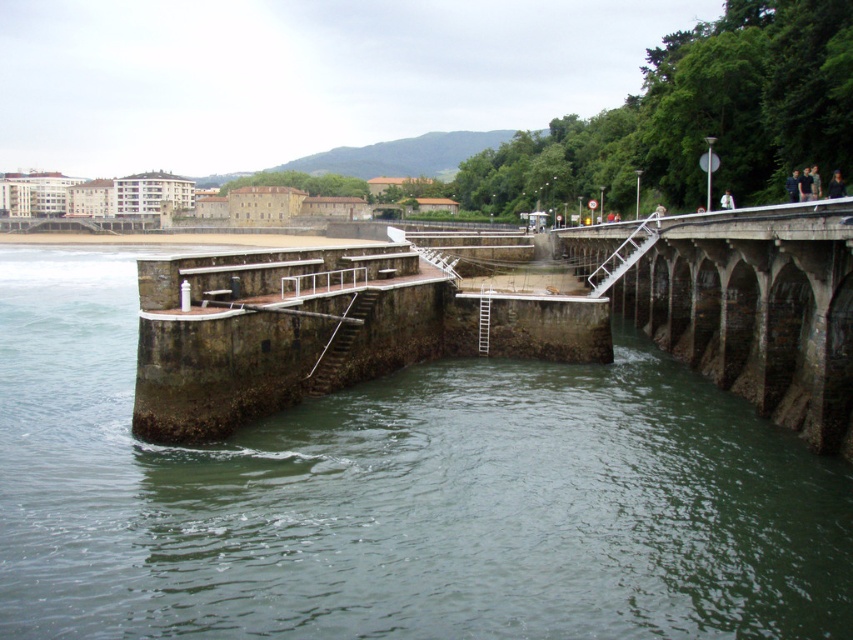
Question: Can you confirm if green stone river at center is positioned below stone bridge at center?

Choices:
 (A) yes
 (B) no

Answer: (A)

Question: Is green stone river at center below stone bridge at center?

Choices:
 (A) no
 (B) yes

Answer: (B)

Question: Considering the real-world distances, which object is closest to the dark blue fabric jacket at upper right?

Choices:
 (A) rusty metal stairs at center
 (B) green stone river at center
 (C) stone bridge at center
 (D) white metal stairs at center

Answer: (D)

Question: Based on their relative distances, which object is farther from the white metal stairs at center?

Choices:
 (A) green stone river at center
 (B) dark blue fabric jacket at upper right
 (C) rusty metal stairs at center

Answer: (A)

Question: Does green stone river at center come behind white metal stairs at center?

Choices:
 (A) no
 (B) yes

Answer: (A)

Question: Estimate the real-world distances between objects in this image. Which object is closer to the white metal stairs at center?

Choices:
 (A) green stone river at center
 (B) stone bridge at center

Answer: (B)